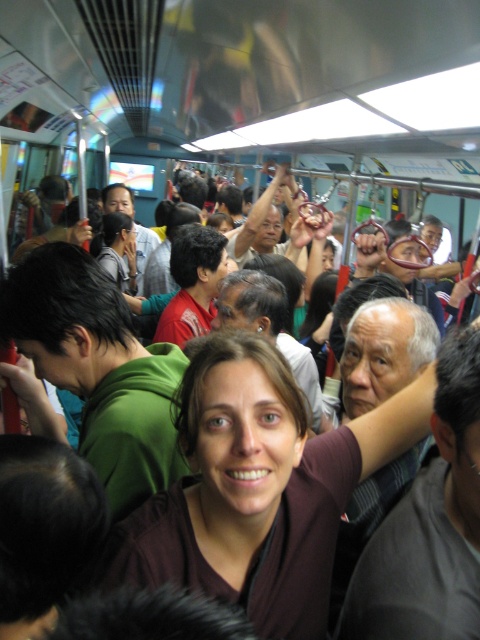
Is the position of brown matte shirt at center less distant than that of matte green shirt at center?

Yes, it is.

Between brown matte shirt at center and matte green shirt at center, which one has less height?

With less height is brown matte shirt at center.

Is point (244, 532) positioned after point (135, 269)?

No, it is not.

What are the coordinates of `brown matte shirt at center` in the screenshot? It's located at (261, 488).